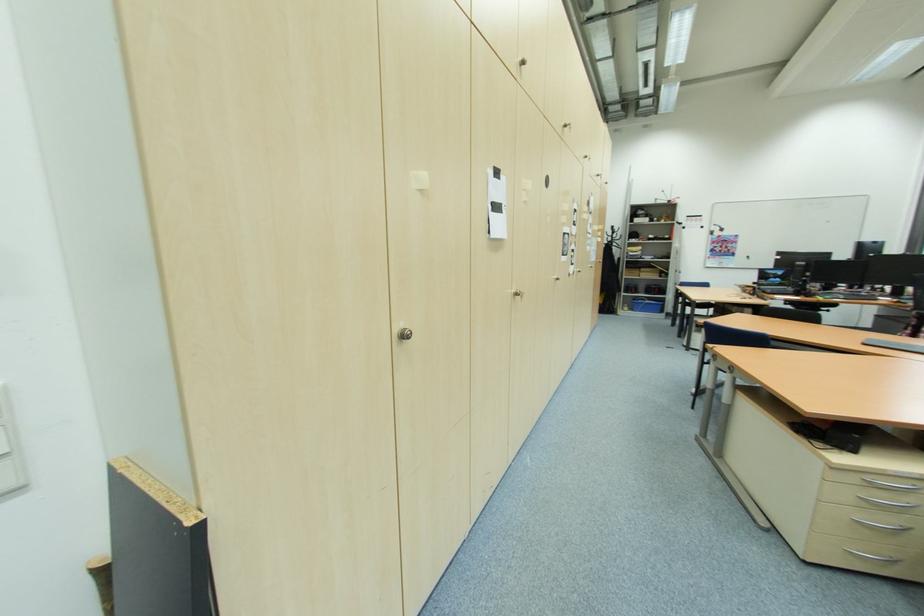
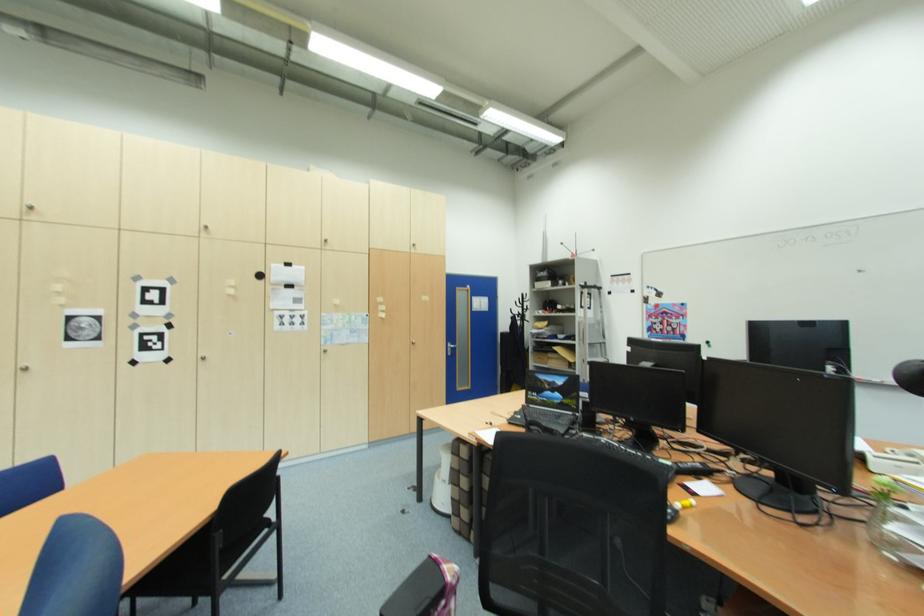
Find the pixel in the second image that matches pixel 603 262 in the first image.

(418, 345)